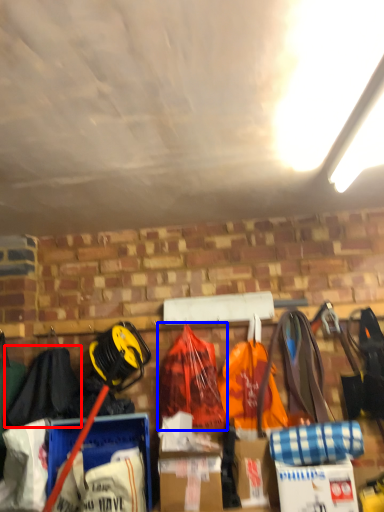
Question: Which object is further to the camera taking this photo, clothing (highlighted by a red box) or backpack (highlighted by a blue box)?

Choices:
 (A) clothing
 (B) backpack

Answer: (B)